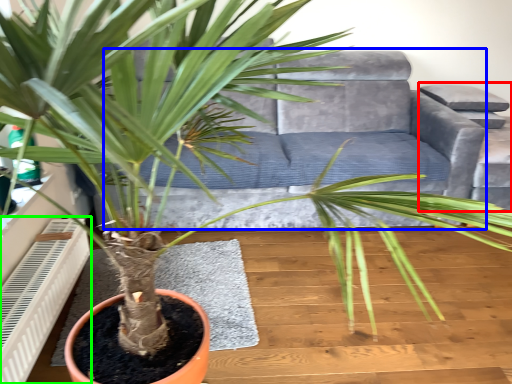
Question: Which object is positioned closest to armchair (highlighted by a red box)? Select from couch (highlighted by a blue box) and air conditioner (highlighted by a green box).

Choices:
 (A) couch
 (B) air conditioner

Answer: (A)